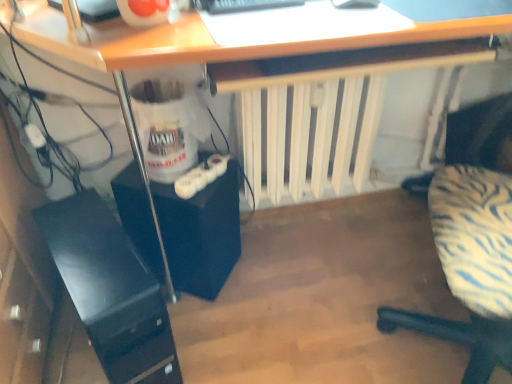
Identify the location of vacant space to the right of black glossy computer tower at lower left, which is the second computer tower from right to left. The image size is (512, 384). (236, 328).